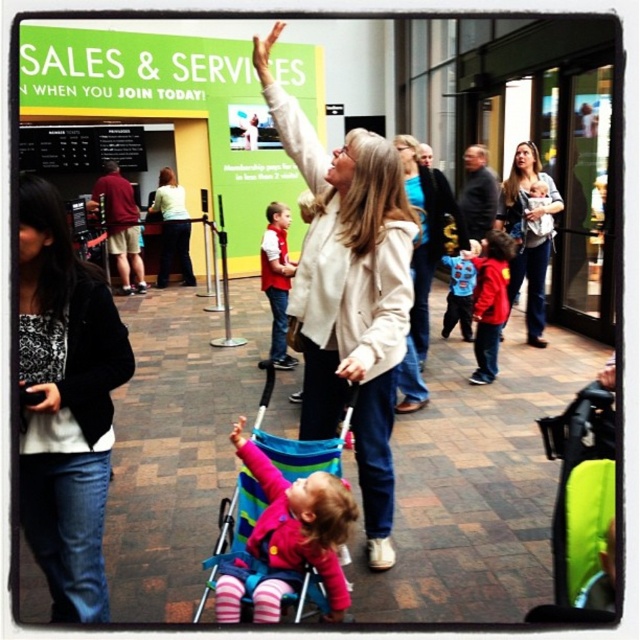
In the scene shown: You are standing at the center of the image. There is a point marked at coordinates (300, 440). What object is located at this point?

The point at coordinates (300, 440) corresponds to the multicolored fabric stroller at center.

You are standing in front of the retail center and see the bright green sign and the black textured jacket at left. Which object is closer to the bottom edge of the image?

The black textured jacket at left is closer to the bottom edge of the image because its position at point 0.103 on the y axis is lower than the green sign.